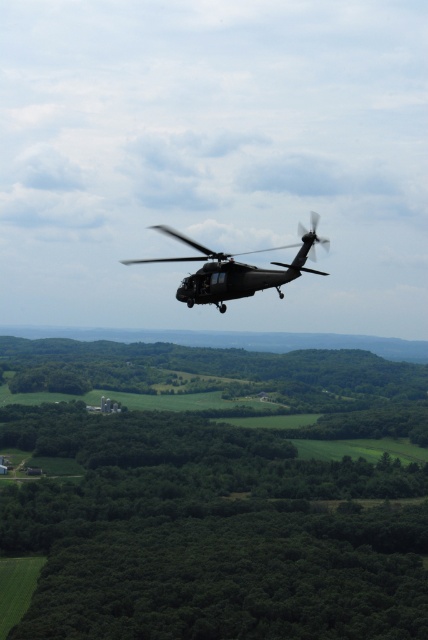
Question: Which object appears closest to the camera in this image?

Choices:
 (A) metallic gray helicopter at center
 (B) green leafy trees at center

Answer: (A)

Question: Does green leafy trees at center appear on the left side of metallic gray helicopter at center?

Choices:
 (A) yes
 (B) no

Answer: (B)

Question: Can you confirm if green leafy trees at center is wider than metallic gray helicopter at center?

Choices:
 (A) yes
 (B) no

Answer: (A)

Question: Does green leafy trees at center have a larger size compared to metallic gray helicopter at center?

Choices:
 (A) yes
 (B) no

Answer: (A)

Question: Which point is farther to the camera?

Choices:
 (A) metallic gray helicopter at center
 (B) green leafy trees at center

Answer: (B)